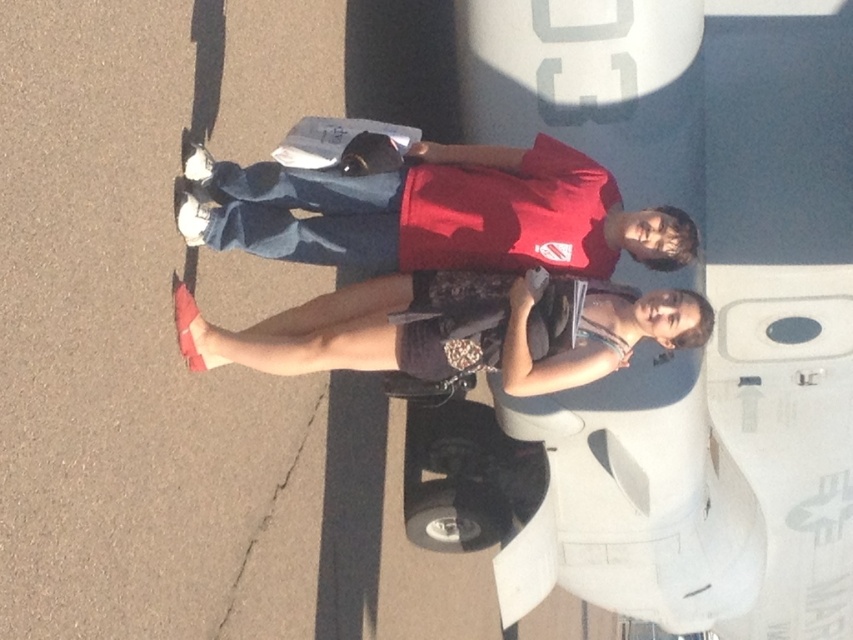
Question: Considering the relative positions of matte red t-shirt at center and leather sandals at lower left in the image provided, where is matte red t-shirt at center located with respect to leather sandals at lower left?

Choices:
 (A) above
 (B) below

Answer: (A)

Question: From the image, what is the correct spatial relationship of matte red t-shirt at center in relation to leather sandals at lower left?

Choices:
 (A) below
 (B) above

Answer: (B)

Question: Is matte red t-shirt at center positioned at the back of leather sandals at lower left?

Choices:
 (A) yes
 (B) no

Answer: (A)

Question: Which of the following is the farthest from the observer?

Choices:
 (A) (538, 230)
 (B) (242, 364)

Answer: (B)

Question: Which point is farther from the camera taking this photo?

Choices:
 (A) pyautogui.click(x=372, y=230)
 (B) pyautogui.click(x=503, y=305)

Answer: (A)